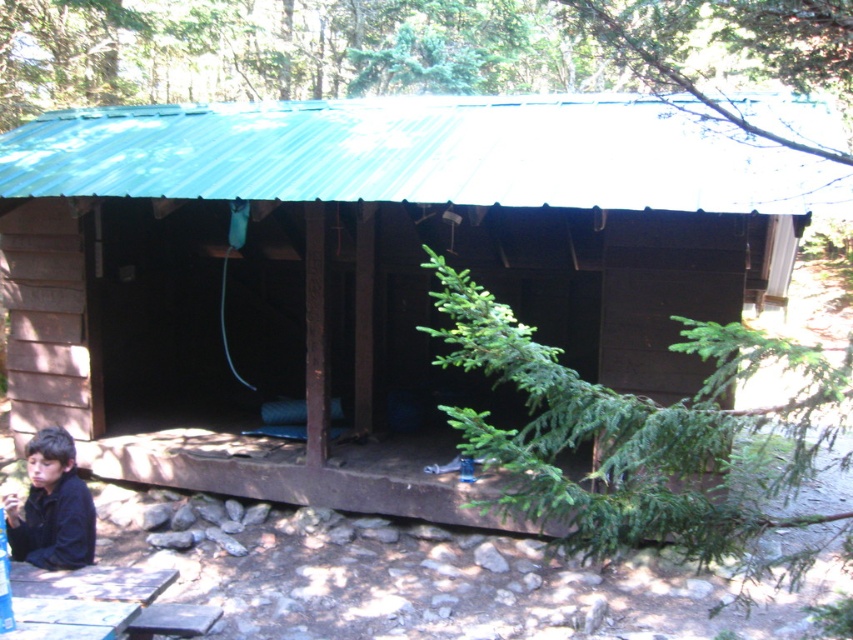
The image size is (853, 640). Describe the element at coordinates (364, 272) in the screenshot. I see `green corrugated metal cabin at center` at that location.

Is green corrugated metal cabin at center bigger than wooden picnic table at lower left?

Actually, green corrugated metal cabin at center might be smaller than wooden picnic table at lower left.

Which is in front, point (706, 196) or point (129, 589)?

Positioned in front is point (129, 589).

Locate an element on the screen. green corrugated metal cabin at center is located at coordinates (364, 272).

Is green corrugated metal cabin at center smaller than black matte jacket at lower left?

No, green corrugated metal cabin at center is not smaller than black matte jacket at lower left.

Is point (163, 179) closer to viewer compared to point (91, 547)?

No, (163, 179) is behind (91, 547).

Is point (627, 323) more distant than point (51, 508)?

Yes, it is behind point (51, 508).

Where is `green corrugated metal cabin at center`? This screenshot has width=853, height=640. green corrugated metal cabin at center is located at coordinates (364, 272).

Between point (15, 596) and point (16, 500), which one is positioned in front?

Point (15, 596) is more forward.

Between point (143, 618) and point (33, 504), which one is positioned behind?

The point (33, 504) is behind.

This screenshot has width=853, height=640. Identify the location of wooden picnic table at lower left. (106, 600).